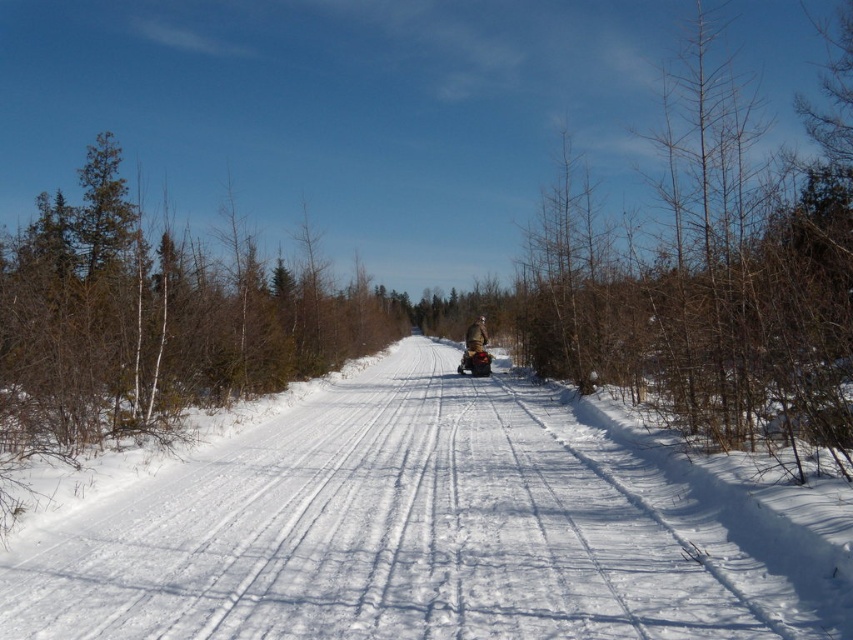
You are a snowmobile rider planning to make a U turn on the white snow trail at center. What is the minimum turning radius required for your snowmobile to safely complete the U turn?

The minimum turning radius required for the snowmobile to safely complete the U turn on the white snow trail at center is 4.53 meters.

You are planning to drive a snowmobile along the white snow trail at center. Considering the width of the trail and the proximity of the bare branches at right, will the snowmobile have enough space to maneuver safely?

The white snow trail at center is narrower than the bare branches at right, so the snowmobile may not have enough space to maneuver safely due to the narrow trail and proximity of the branches.

You are planning to take a photo of the matte black snowmobile at center and the brown fuzzy jacket at center. Since the sun is shining from the right, where should you position yourself to avoid shadows from the snowmobile blocking the jacket?

Position yourself to the right side of the matte black snowmobile at center so that the sunlight from the right will cast shadows away from the brown fuzzy jacket at center, ensuring it remains well lit and unobstructed.